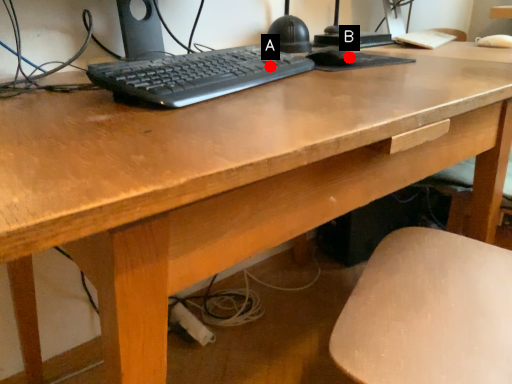
Question: Two points are circled on the image, labeled by A and B beside each circle. Which point appears closest to the camera in this image?

Choices:
 (A) A is closer
 (B) B is closer

Answer: (A)